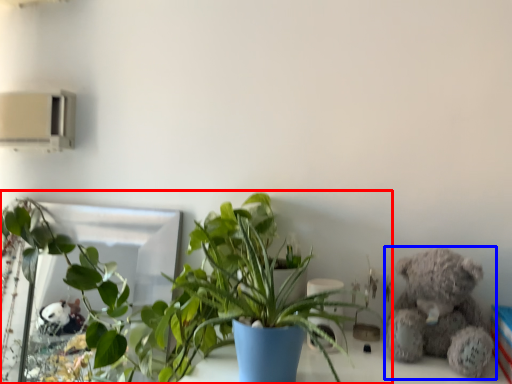
Question: Which object is closer to the camera taking this photo, houseplant (highlighted by a red box) or teddy bear (highlighted by a blue box)?

Choices:
 (A) houseplant
 (B) teddy bear

Answer: (A)